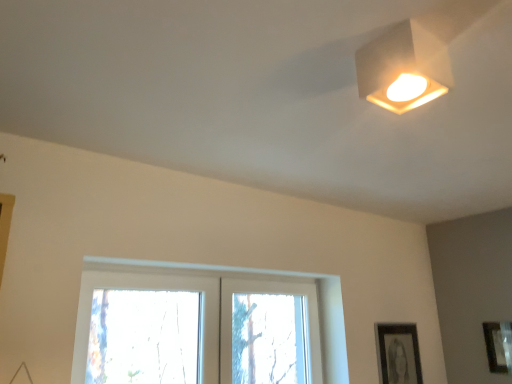
Question: Is point (404, 342) closer or farther from the camera than point (151, 284)?

Choices:
 (A) farther
 (B) closer

Answer: (A)

Question: From a real-world perspective, is black matte picture frame at lower right, the first picture frame in the left-to-right sequence, physically located above or below clear glass window at center?

Choices:
 (A) above
 (B) below

Answer: (B)

Question: Considering the real-world distances, which object is farthest from the black matte picture frame at lower right, the first picture frame in the left-to-right sequence?

Choices:
 (A) clear glass window at center
 (B) matte black picture frame at lower right, the first picture frame from the right
 (C) white matte square lamp at upper right

Answer: (C)

Question: Estimate the real-world distances between objects in this image. Which object is closer to the white matte square lamp at upper right?

Choices:
 (A) clear glass window at center
 (B) black matte picture frame at lower right, the first picture frame in the left-to-right sequence
 (C) matte black picture frame at lower right, the first picture frame from the right

Answer: (A)